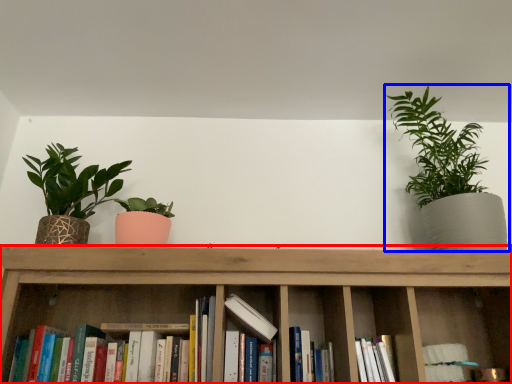
Question: Which point is closer to the camera, shelf (highlighted by a red box) or houseplant (highlighted by a blue box)?

Choices:
 (A) shelf
 (B) houseplant

Answer: (A)